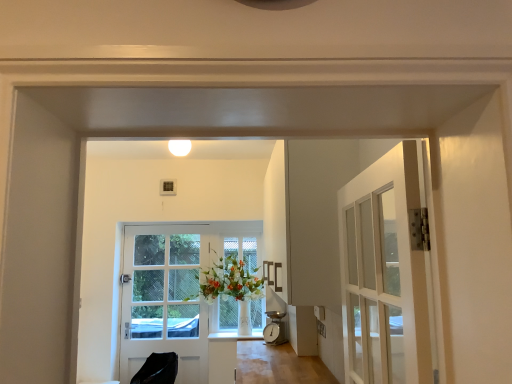
What is the approximate height of white glossy door at center?

The height of white glossy door at center is 1.53 meters.

At what (x,y) coordinates should I click in order to perform the action: click on clear glass window at center. Please return your answer as a coordinate pair (x, y). Looking at the image, I should click on (241, 251).

Measure the distance between clear glass window at center and camera.

clear glass window at center is 3.92 meters away from camera.

Where is `black leather chair at lower left`? black leather chair at lower left is located at coordinates (158, 369).

Does black leather chair at lower left have a larger size compared to white matte light fixture at upper center?

Yes, black leather chair at lower left is bigger than white matte light fixture at upper center.

From a real-world perspective, does black leather chair at lower left sit lower than white matte light fixture at upper center?

Yes.

Does point (161, 368) come in front of point (186, 143)?

Yes, point (161, 368) is in front of point (186, 143).

Is white matte light fixture at upper center outside of white glossy door at center?

white matte light fixture at upper center lies outside white glossy door at center's area.

From a real-world perspective, who is located higher, white matte light fixture at upper center or white glossy door at center?

white matte light fixture at upper center is physically above.

Is white matte light fixture at upper center not near white glossy door at center?

Yes, white matte light fixture at upper center and white glossy door at center are located far from each other.

Considering the sizes of objects white matte light fixture at upper center and white glossy door at center in the image provided, who is shorter, white matte light fixture at upper center or white glossy door at center?

With less height is white matte light fixture at upper center.

From the image's perspective, who appears lower, black leather chair at lower left or clear glass window at center?

black leather chair at lower left appears lower in the image.

Does black leather chair at lower left turn towards clear glass window at center?

No, black leather chair at lower left does not turn towards clear glass window at center.

In the scene shown: Considering the relative sizes of black leather chair at lower left and clear glass window at center in the image provided, is black leather chair at lower left taller than clear glass window at center?

Incorrect, the height of black leather chair at lower left is not larger of that of clear glass window at center.

Based on the photo, considering the positions of objects white matte light fixture at upper center and black leather chair at lower left in the image provided, who is more to the right, white matte light fixture at upper center or black leather chair at lower left?

Positioned to the right is white matte light fixture at upper center.

Is white matte light fixture at upper center not near black leather chair at lower left?

Yes, white matte light fixture at upper center and black leather chair at lower left are located far from each other.

Considering the sizes of objects white matte light fixture at upper center and black leather chair at lower left in the image provided, who is thinner, white matte light fixture at upper center or black leather chair at lower left?

white matte light fixture at upper center.

Where is `chair below the white matte light fixture at upper center (from a real-world perspective)`? This screenshot has height=384, width=512. chair below the white matte light fixture at upper center (from a real-world perspective) is located at coordinates (158, 369).

Between white glossy door at center and white matte light fixture at upper center, which one has larger size?

white glossy door at center is bigger.

Does white glossy door at center have a lesser width compared to white matte light fixture at upper center?

Yes, white glossy door at center is thinner than white matte light fixture at upper center.

Find the location of a particular element. The height and width of the screenshot is (384, 512). door that is below the white matte light fixture at upper center (from the image's perspective) is located at coordinates (178, 291).

Is white glossy door at center to the right of white matte light fixture at upper center from the viewer's perspective?

In fact, white glossy door at center is to the left of white matte light fixture at upper center.

Is clear glass window at center not near white matte light fixture at upper center?

Indeed, clear glass window at center is not near white matte light fixture at upper center.

Image resolution: width=512 pixels, height=384 pixels. Find the location of `light fixture that is in front of the clear glass window at center`. light fixture that is in front of the clear glass window at center is located at coordinates (179, 147).

How many degrees apart are the facing directions of clear glass window at center and white matte light fixture at upper center?

clear glass window at center and white matte light fixture at upper center are facing 0.504 degrees away from each other.

From a real-world perspective, is white matte light fixture at upper center below clear glass window at center?

No, from a real-world perspective, white matte light fixture at upper center is not below clear glass window at center.

Which of these two, white matte light fixture at upper center or clear glass window at center, is wider?

With larger width is white matte light fixture at upper center.

Would you say white matte light fixture at upper center is inside or outside clear glass window at center?

white matte light fixture at upper center is not inside clear glass window at center, it's outside.

Between point (175, 141) and point (215, 304), which one is positioned behind?

The point (215, 304) is more distant.

Find the location of a particular element. light fixture located above the black leather chair at lower left (from a real-world perspective) is located at coordinates coord(179,147).

Locate an element on the screen. Image resolution: width=512 pixels, height=384 pixels. door below the white matte light fixture at upper center (from the image's perspective) is located at coordinates (178, 291).

Based on the photo, looking at the image, which one is located closer to clear glass window at center, black leather chair at lower left or white matte light fixture at upper center?

The object closer to clear glass window at center is black leather chair at lower left.

Looking at this image, considering their positions, is white matte light fixture at upper center positioned closer to clear glass window at center than white glossy door at center?

Among the two, white glossy door at center is located nearer to clear glass window at center.

When comparing their distances from clear glass window at center, does black leather chair at lower left or white glossy door at center seem further?

Among the two, black leather chair at lower left is located further to clear glass window at center.

Which object lies further to the anchor point black leather chair at lower left, white matte light fixture at upper center or clear glass window at center?

white matte light fixture at upper center lies further to black leather chair at lower left than the other object.

From the picture: Which object lies further to the anchor point black leather chair at lower left, white glossy door at center or white matte light fixture at upper center?

white matte light fixture at upper center is positioned further to the anchor black leather chair at lower left.

From the image, which object appears to be nearer to clear glass window at center, white matte light fixture at upper center or black leather chair at lower left?

The object closer to clear glass window at center is black leather chair at lower left.

When comparing their distances from white matte light fixture at upper center, does white glossy door at center or clear glass window at center seem further?

white glossy door at center.

Which object lies further to the anchor point black leather chair at lower left, white matte light fixture at upper center or white glossy door at center?

white matte light fixture at upper center is further to black leather chair at lower left.

I want to click on chair situated between white glossy door at center and clear glass window at center from left to right, so click(158, 369).

Locate an element on the screen. The height and width of the screenshot is (384, 512). window between white matte light fixture at upper center and white glossy door at center in the vertical direction is located at coordinates (241, 251).

Identify the location of window between white matte light fixture at upper center and black leather chair at lower left in the vertical direction. (241, 251).

At what (x,y) coordinates should I click in order to perform the action: click on door between white matte light fixture at upper center and black leather chair at lower left in the vertical direction. Please return your answer as a coordinate pair (x, y). Looking at the image, I should click on 178,291.